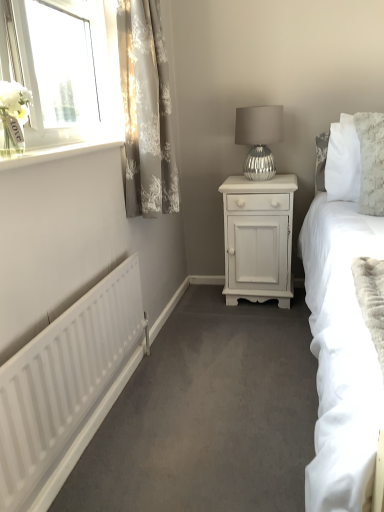
You are a GUI agent. You are given a task and a screenshot of the screen. Output one action in this format:
    pyautogui.click(x=<x>, y=<y>)
    Task: Click on the free spot behind white matte radiator at lower left
    
    Given the screenshot: What is the action you would take?
    pyautogui.click(x=184, y=351)